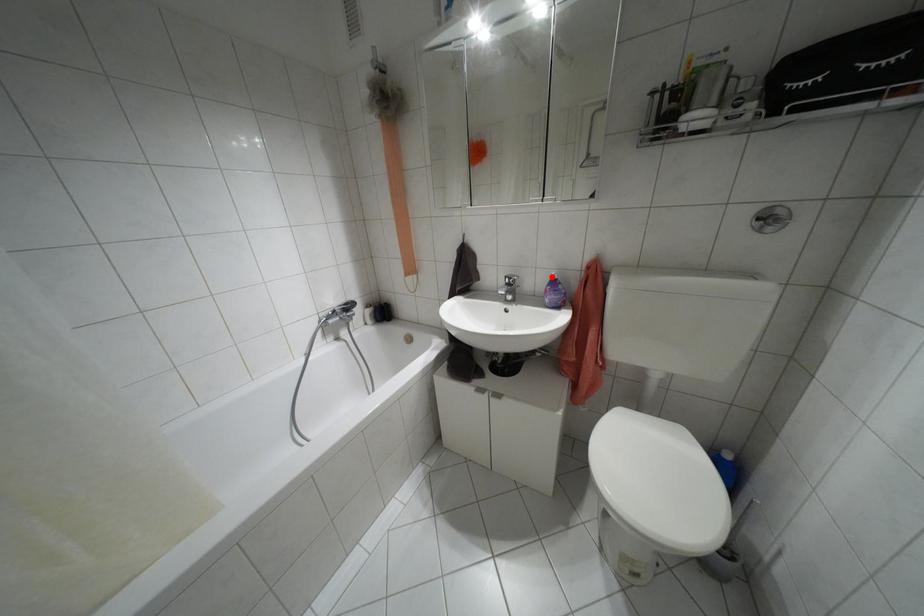
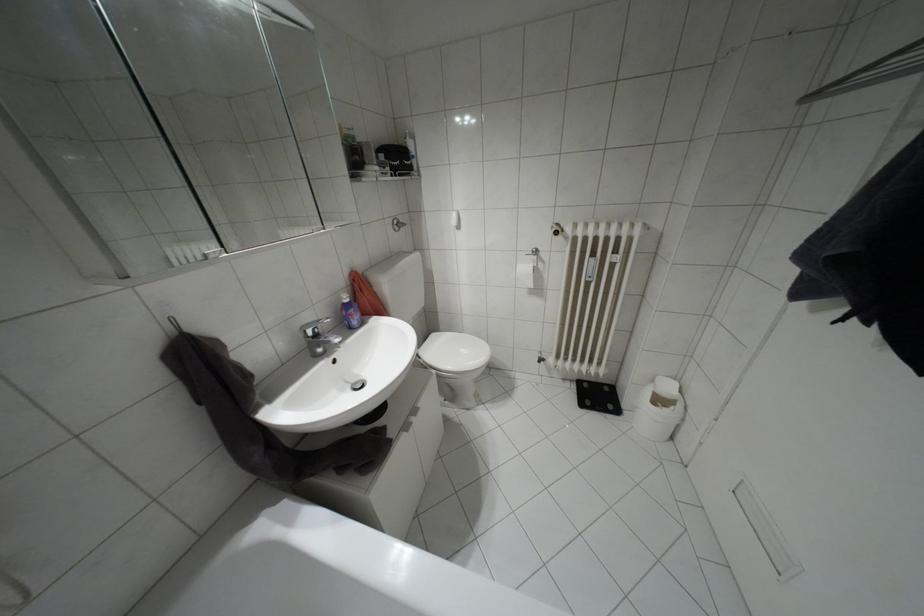
Where in the second image is the point corresponding to the highlighted location from the first image?

(346, 300)